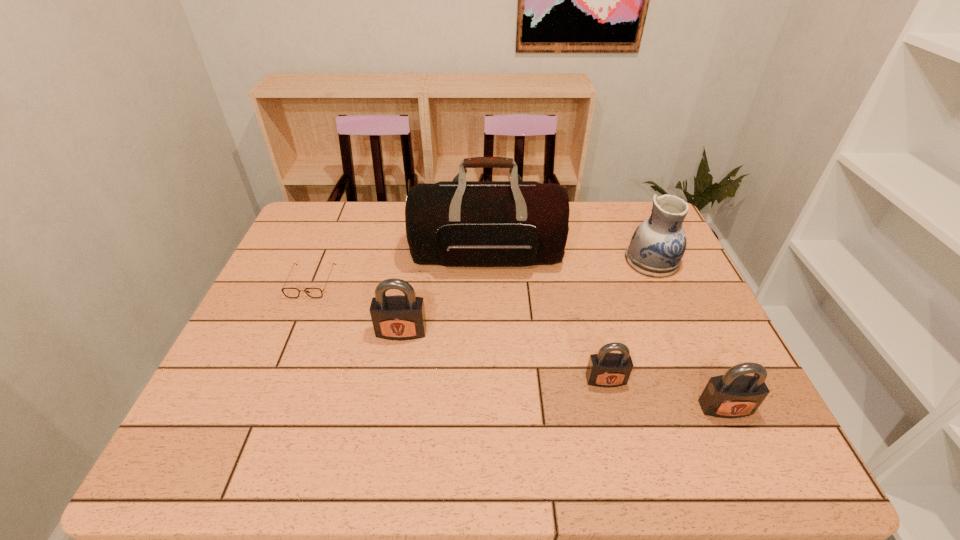
If equal spacing is the goal by inserting an additional padlock among them, please point out a vacant space for this new padlock. Please provide its 2D coordinates. Your answer should be formatted as a tuple, i.e. [(x, y)], where the tuple contains the x and y coordinates of a point satisfying the conditions above.

[(498, 354)]